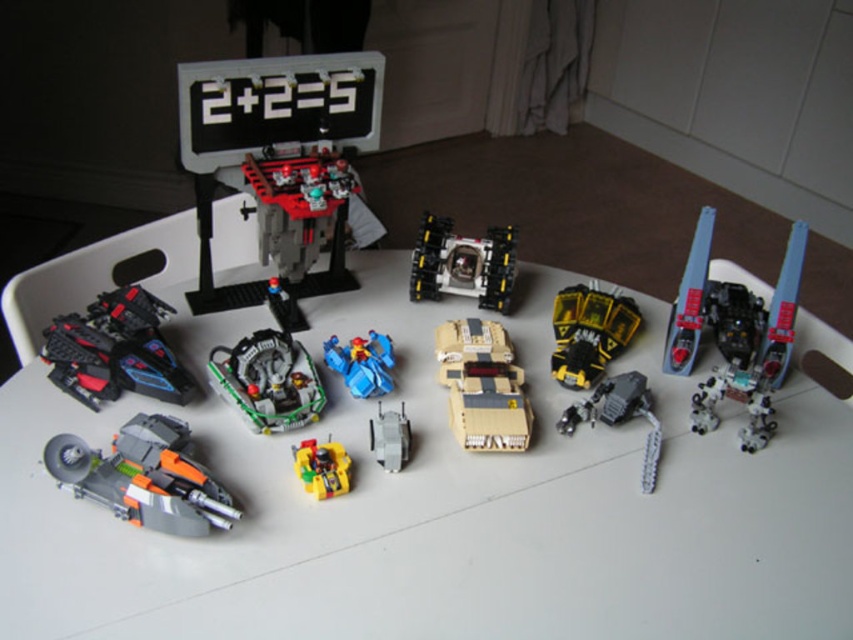
You are a child trying to build a LEGO set and you see the matte black vehicle at center and the tan matte tank at center. According to the image, which one is positioned to the left?

The matte black vehicle at center is positioned to the left of the tan matte tank at center.

You are a child who wants to place a small LEGO figure on the yellow matte truck at center without blocking the matte black vehicle at center. Is this possible?

The matte black vehicle at center is located above the yellow matte truck at center, so placing a LEGO figure on the yellow matte truck at center would not block the matte black vehicle at center since it is positioned above it.

You are a toy organizer arranging LEGO models on a tray. You need to place a new LEGO car at the same position as the matte black vehicle at center. What are the coordinates where you should place the new LEGO car?

The matte black vehicle at center is located at point coordinates [302,216], so you should place the new LEGO car at those coordinates.